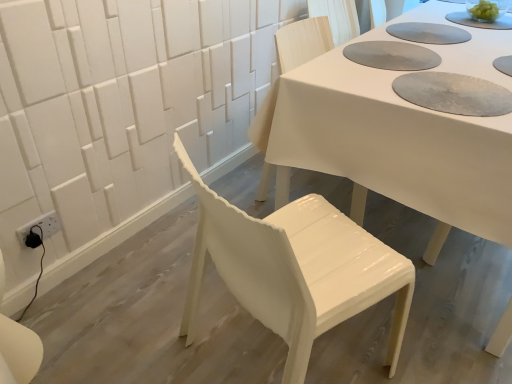
Describe the element at coordinates (303, 42) in the screenshot. The height and width of the screenshot is (384, 512). I see `white glossy chair at center, the 2th chair in the front-to-back sequence` at that location.

You are a GUI agent. You are given a task and a screenshot of the screen. Output one action in this format:
    pyautogui.click(x=<x>, y=<y>)
    Task: Click on the textured gray paper plate at upper center
    The width and height of the screenshot is (512, 384).
    Given the screenshot: What is the action you would take?
    pyautogui.click(x=392, y=55)

The height and width of the screenshot is (384, 512). In order to click on white glossy chair at center, which ranks as the first chair in front-to-back order in this screenshot , I will do tap(296, 269).

What do you see at coordinates (395, 147) in the screenshot? The width and height of the screenshot is (512, 384). I see `white glossy table at center` at bounding box center [395, 147].

What are the coordinates of `white glossy chair at center, the 1th chair viewed from the back` in the screenshot? It's located at (303, 42).

Measure the distance between white glossy chair at center, the 2th chair in the front-to-back sequence, and white glossy table at center.

They are 36.25 centimeters apart.

Is the surface of white glossy chair at center, the 1th chair viewed from the back, in direct contact with white glossy table at center?

They are not placed beside each other.

From the image's perspective, is white glossy chair at center, the 2th chair in the front-to-back sequence, located beneath white glossy table at center?

Indeed, from the image's perspective, white glossy chair at center, the 2th chair in the front-to-back sequence, is shown beneath white glossy table at center.

From a real-world perspective, is white glossy chair at center, the 2th chair in the front-to-back sequence, positioned above or below white glossy table at center?

From a real-world perspective, white glossy chair at center, the 2th chair in the front-to-back sequence, is physically above white glossy table at center.

Is white glossy chair at center, the second chair positioned from the back, spatially inside white glossy chair at center, the 1th chair viewed from the back, or outside of it?

white glossy chair at center, the second chair positioned from the back, is outside white glossy chair at center, the 1th chair viewed from the back.

Considering the positions of objects white glossy chair at center, which ranks as the first chair in front-to-back order, and white glossy chair at center, the 2th chair in the front-to-back sequence, in the image provided, who is more to the right, white glossy chair at center, which ranks as the first chair in front-to-back order, or white glossy chair at center, the 2th chair in the front-to-back sequence,?

white glossy chair at center, the 2th chair in the front-to-back sequence, is more to the right.

Is white glossy chair at center, the second chair positioned from the back, in contact with white glossy chair at center, the 2th chair in the front-to-back sequence?

No.

Is white glossy chair at center, the second chair positioned from the back, facing away from white glossy table at center?

No.

Between white glossy chair at center, the second chair positioned from the back, and white glossy table at center, which one has smaller width?

white glossy chair at center, the second chair positioned from the back, is thinner.

Could white glossy table at center be considered to be inside white glossy chair at center, which ranks as the first chair in front-to-back order?

No, white glossy table at center is located outside of white glossy chair at center, which ranks as the first chair in front-to-back order.

Can you tell me how much white glossy chair at center, which ranks as the first chair in front-to-back order, and white glossy table at center differ in facing direction?

There is a 69.4-degree angle between the facing directions of white glossy chair at center, which ranks as the first chair in front-to-back order, and white glossy table at center.

Which is more to the left, textured gray paper plate at upper center or white glossy chair at center, the 2th chair in the front-to-back sequence?

white glossy chair at center, the 2th chair in the front-to-back sequence.

From the image's perspective, is textured gray paper plate at upper center above or below white glossy chair at center, the 1th chair viewed from the back?

Clearly, from the image's perspective, textured gray paper plate at upper center is above white glossy chair at center, the 1th chair viewed from the back.

Identify the location of the 1st chair counting from the left of the textured gray paper plate at upper center. The width and height of the screenshot is (512, 384). (303, 42).

Find the location of a particular element. The width and height of the screenshot is (512, 384). paper plate located behind the white glossy chair at center, the second chair positioned from the back is located at coordinates (392, 55).

Between white glossy chair at center, which ranks as the first chair in front-to-back order, and textured gray paper plate at upper center, which one has larger width?

With larger width is white glossy chair at center, which ranks as the first chair in front-to-back order.

Can you tell me how much white glossy chair at center, the second chair positioned from the back, and textured gray paper plate at upper center differ in facing direction?

The angle between the facing direction of white glossy chair at center, the second chair positioned from the back, and the facing direction of textured gray paper plate at upper center is 107 degrees.

Is white glossy chair at center, which ranks as the first chair in front-to-back order, directly adjacent to textured gray paper plate at upper center?

No, white glossy chair at center, which ranks as the first chair in front-to-back order, is not with textured gray paper plate at upper center.

From a real-world perspective, who is located higher, textured gray paper plate at upper center or white glossy chair at center, the second chair positioned from the back?

textured gray paper plate at upper center is physically above.

Is textured gray paper plate at upper center oriented towards white glossy chair at center, which ranks as the first chair in front-to-back order?

No, textured gray paper plate at upper center is not turned towards white glossy chair at center, which ranks as the first chair in front-to-back order.

Where is `paper plate that appears behind the white glossy chair at center, which ranks as the first chair in front-to-back order`? The image size is (512, 384). paper plate that appears behind the white glossy chair at center, which ranks as the first chair in front-to-back order is located at coordinates (392, 55).

Is textured gray paper plate at upper center spatially inside white glossy chair at center, the second chair positioned from the back, or outside of it?

textured gray paper plate at upper center is not inside white glossy chair at center, the second chair positioned from the back, it's outside.

Is the depth of white glossy chair at center, the 1th chair viewed from the back, greater than that of textured gray paper plate at upper center?

Yes, it is behind textured gray paper plate at upper center.

From the image's perspective, is white glossy chair at center, the 2th chair in the front-to-back sequence, located above or below textured gray paper plate at upper center?

Clearly, from the image's perspective, white glossy chair at center, the 2th chair in the front-to-back sequence, is below textured gray paper plate at upper center.

Which object is wider, white glossy chair at center, the 2th chair in the front-to-back sequence, or textured gray paper plate at upper center?

With larger width is textured gray paper plate at upper center.

Which of these two, white glossy chair at center, the 1th chair viewed from the back, or textured gray paper plate at upper center, stands shorter?

Standing shorter between the two is textured gray paper plate at upper center.

At what (x,y) coordinates should I click in order to perform the action: click on table on the right of white glossy chair at center, the 1th chair viewed from the back. Please return your answer as a coordinate pair (x, y). Image resolution: width=512 pixels, height=384 pixels. Looking at the image, I should click on (395, 147).

Find the location of a particular element. This screenshot has width=512, height=384. chair located above the white glossy chair at center, the second chair positioned from the back (from a real-world perspective) is located at coordinates (303, 42).

Considering their positions, is white glossy chair at center, the 2th chair in the front-to-back sequence, positioned further to white glossy chair at center, which ranks as the first chair in front-to-back order, than white glossy table at center?

Based on the image, white glossy chair at center, the 2th chair in the front-to-back sequence, appears to be further to white glossy chair at center, which ranks as the first chair in front-to-back order.

Looking at the image, which one is located closer to textured gray paper plate at upper center, white glossy chair at center, the 2th chair in the front-to-back sequence, or white glossy chair at center, which ranks as the first chair in front-to-back order?

white glossy chair at center, the 2th chair in the front-to-back sequence.

When comparing their distances from white glossy table at center, does white glossy chair at center, the 2th chair in the front-to-back sequence, or white glossy chair at center, which ranks as the first chair in front-to-back order, seem closer?

Based on the image, white glossy chair at center, the 2th chair in the front-to-back sequence, appears to be nearer to white glossy table at center.

Which object lies further to the anchor point textured gray paper plate at upper center, white glossy chair at center, the second chair positioned from the back, or white glossy chair at center, the 2th chair in the front-to-back sequence?

Among the two, white glossy chair at center, the second chair positioned from the back, is located further to textured gray paper plate at upper center.

Estimate the real-world distances between objects in this image. Which object is further from white glossy chair at center, the 2th chair in the front-to-back sequence, white glossy chair at center, the second chair positioned from the back, or textured gray paper plate at upper center?

white glossy chair at center, the second chair positioned from the back.

Estimate the real-world distances between objects in this image. Which object is closer to white glossy chair at center, the 1th chair viewed from the back, white glossy chair at center, which ranks as the first chair in front-to-back order, or white glossy table at center?

white glossy table at center lies closer to white glossy chair at center, the 1th chair viewed from the back, than the other object.

Which object lies further to the anchor point white glossy chair at center, which ranks as the first chair in front-to-back order, white glossy table at center or textured gray paper plate at upper center?

textured gray paper plate at upper center is positioned further to the anchor white glossy chair at center, which ranks as the first chair in front-to-back order.

Based on their spatial positions, is white glossy chair at center, the 2th chair in the front-to-back sequence, or white glossy table at center closer to textured gray paper plate at upper center?

white glossy table at center lies closer to textured gray paper plate at upper center than the other object.

You are a GUI agent. You are given a task and a screenshot of the screen. Output one action in this format:
    pyautogui.click(x=<x>, y=<y>)
    Task: Click on the paper plate located between white glossy chair at center, the 1th chair viewed from the back, and white glossy table at center in the left-right direction
    The width and height of the screenshot is (512, 384).
    Given the screenshot: What is the action you would take?
    pyautogui.click(x=392, y=55)

Find the location of a particular element. chair between white glossy chair at center, the second chair positioned from the back, and white glossy table at center is located at coordinates (303, 42).

You are a GUI agent. You are given a task and a screenshot of the screen. Output one action in this format:
    pyautogui.click(x=<x>, y=<y>)
    Task: Click on the paper plate between white glossy chair at center, which ranks as the first chair in front-to-back order, and white glossy table at center, in the horizontal direction
    The width and height of the screenshot is (512, 384).
    Given the screenshot: What is the action you would take?
    pyautogui.click(x=392, y=55)

Locate an element on the screen. paper plate between white glossy chair at center, the second chair positioned from the back, and white glossy chair at center, the 2th chair in the front-to-back sequence, in the front-back direction is located at coordinates (392, 55).